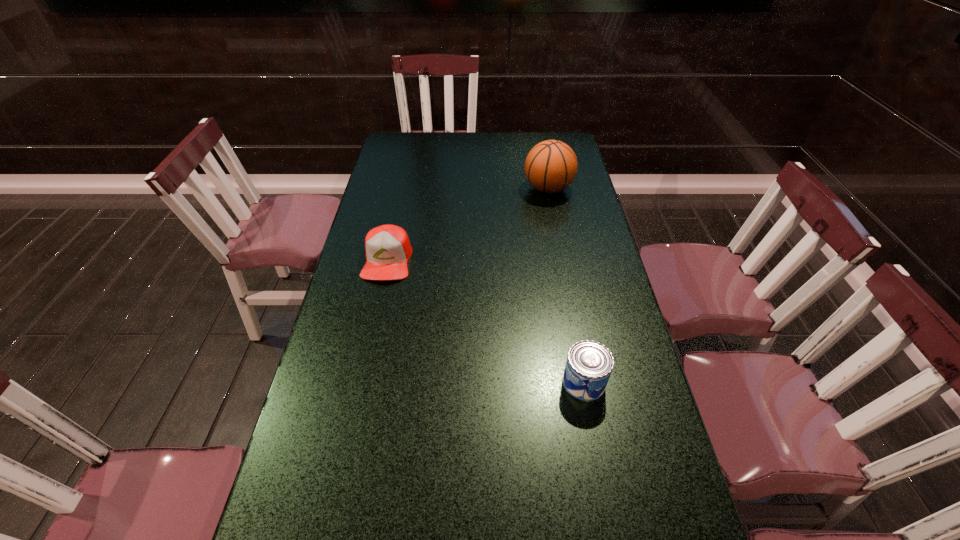
Image resolution: width=960 pixels, height=540 pixels. Identify the location of the tallest object. (551, 166).

Locate an element on the screen. basketball is located at coordinates 551,166.

In order to click on can in this screenshot , I will do `click(589, 364)`.

The height and width of the screenshot is (540, 960). In order to click on the leftmost object in this screenshot , I will do `click(388, 248)`.

This screenshot has width=960, height=540. In order to click on the second farthest object in this screenshot , I will do `click(388, 248)`.

At what (x,y) coordinates should I click in order to perform the action: click on vacant space located 0.360m on the left of the tallest object. Please return your answer as a coordinate pair (x, y). The image size is (960, 540). Looking at the image, I should click on [x=426, y=188].

At what (x,y) coordinates should I click in order to perform the action: click on vacant space located on the front label of the nearest object. Please return your answer as a coordinate pair (x, y). The image size is (960, 540). Looking at the image, I should click on (500, 382).

At what (x,y) coordinates should I click in order to perform the action: click on vacant region located on the front label of the nearest object. Please return your answer as a coordinate pair (x, y). The height and width of the screenshot is (540, 960). Looking at the image, I should click on (492, 382).

The image size is (960, 540). What are the coordinates of `vacant space located 0.330m on the front label of the nearest object` in the screenshot? It's located at (425, 382).

This screenshot has width=960, height=540. I want to click on vacant space located on the front-facing side of the baseball cap, so click(362, 375).